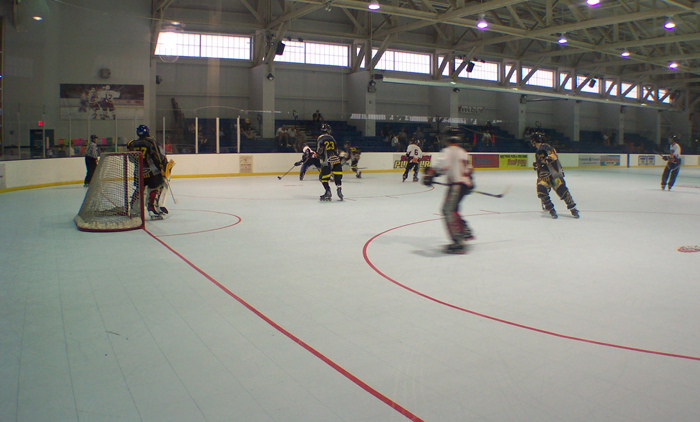
What are the coordinates of `small red light` in the screenshot? It's located at (41, 123).